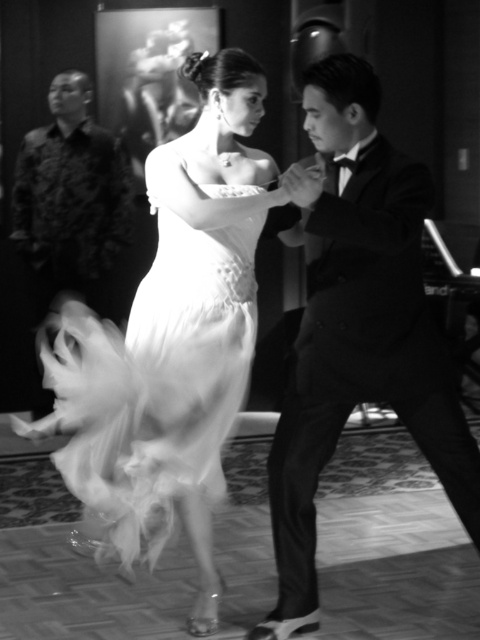
Is satin dress at center thinner than shiny black suit at center?

No.

Does satin dress at center appear on the right side of shiny black suit at center?

No, satin dress at center is not to the right of shiny black suit at center.

Is point (164, 228) positioned behind point (388, 288)?

Yes, point (164, 228) is farther from viewer.

This screenshot has height=640, width=480. I want to click on satin dress at center, so click(x=191, y=326).

Can you confirm if satin dress at center is positioned below patterned fabric shirt at left?

Indeed, satin dress at center is positioned under patterned fabric shirt at left.

Does satin dress at center have a smaller size compared to patterned fabric shirt at left?

No.

The image size is (480, 640). What do you see at coordinates (191, 326) in the screenshot? I see `satin dress at center` at bounding box center [191, 326].

Where is `satin dress at center`? satin dress at center is located at coordinates (191, 326).

Does shiny black suit at center have a lesser width compared to patterned fabric shirt at left?

In fact, shiny black suit at center might be wider than patterned fabric shirt at left.

Does shiny black suit at center have a greater height compared to patterned fabric shirt at left?

Indeed, shiny black suit at center has a greater height compared to patterned fabric shirt at left.

Does point (361, 305) lie in front of point (88, 276)?

Yes.

Image resolution: width=480 pixels, height=640 pixels. I want to click on shiny black suit at center, so click(358, 328).